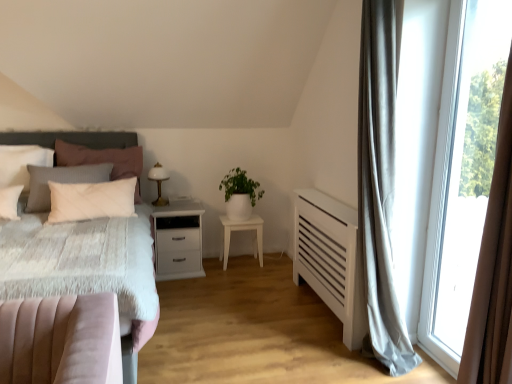
Question: In the image, is white glossy table lamp at center positioned in front of or behind white matte nightstand at center, the 2th nightstand from the left?

Choices:
 (A) front
 (B) behind

Answer: (A)

Question: In the image, is white glossy table lamp at center on the left side or the right side of white matte nightstand at center, the 2th nightstand from the left?

Choices:
 (A) left
 (B) right

Answer: (A)

Question: Based on their relative distances, which object is farther from the white matte nightstand at center, which is the first nightstand from left to right?

Choices:
 (A) velvet pink bed at left
 (B) white matte plant at center
 (C) white matte nightstand at center, the 1th nightstand in the right-to-left sequence
 (D) white matte pillow at left, which ranks as the 1th pillow in right-to-left order
 (E) dark gray textured headboard at left

Answer: (A)

Question: Estimate the real-world distances between objects in this image. Which object is farther from the dark gray textured headboard at left?

Choices:
 (A) white matte nightstand at center, the 1th nightstand in the right-to-left sequence
 (B) white glossy table lamp at center
 (C) matte pink pillow at left, marked as the second pillow in a right-to-left arrangement
 (D) white matte plant at center
 (E) white matte nightstand at center, which is the first nightstand from left to right

Answer: (A)